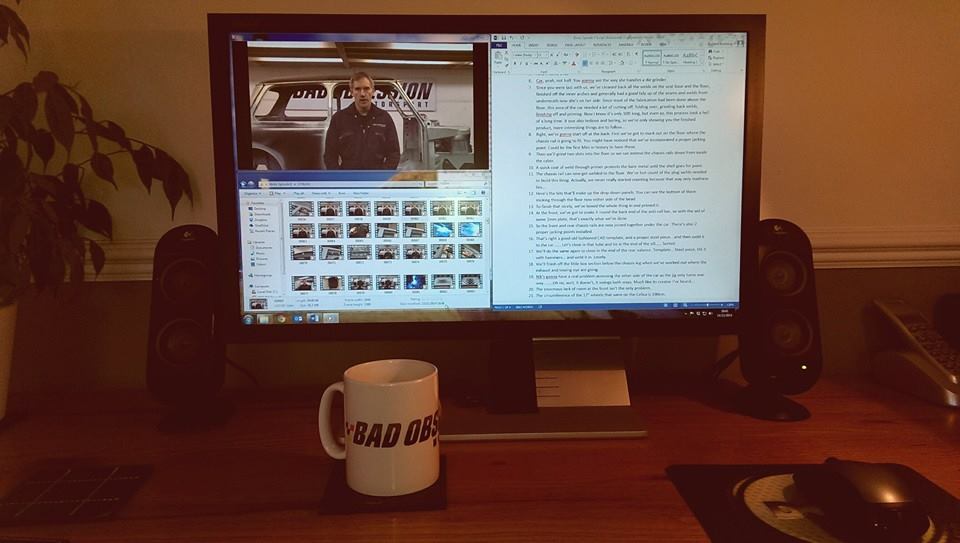
Locate an element on the screen. mouse pad is located at coordinates (727, 520).